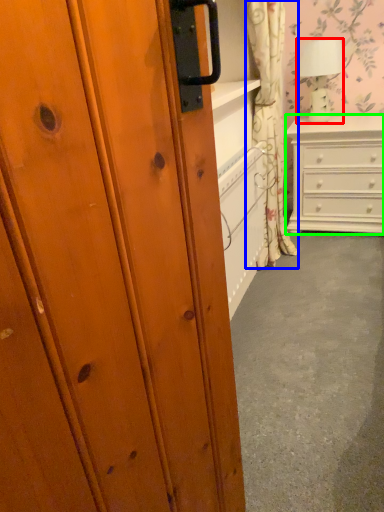
Question: Which object is the farthest from lamp (highlighted by a red box)? Choose among these: curtain (highlighted by a blue box) or chest of drawers (highlighted by a green box).

Choices:
 (A) curtain
 (B) chest of drawers

Answer: (A)